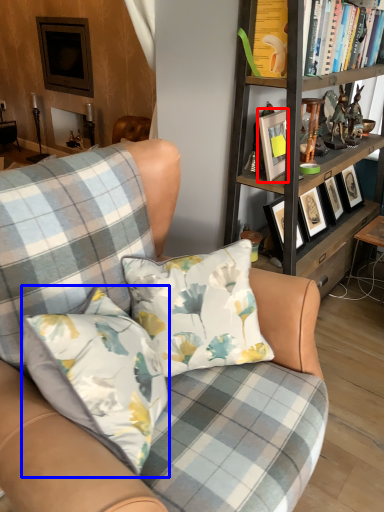
Question: Which of the following is the farthest to the observer, picture frame (highlighted by a red box) or pillow (highlighted by a blue box)?

Choices:
 (A) picture frame
 (B) pillow

Answer: (A)